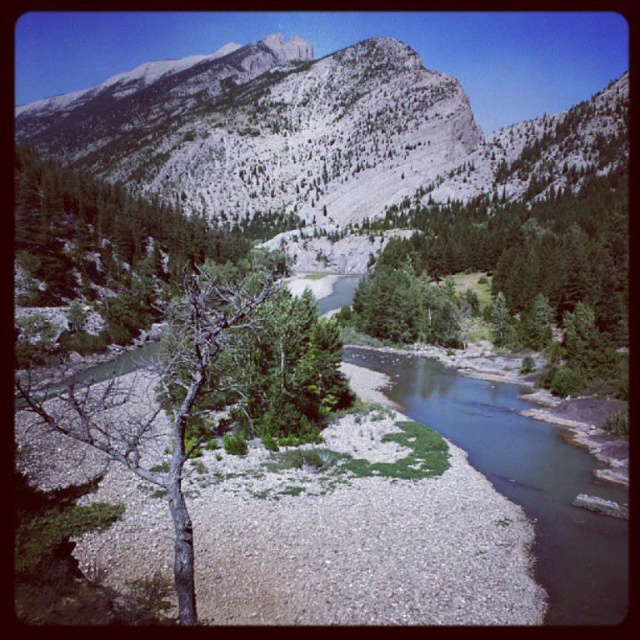
Between gray rocky mountain at upper center and smooth gravel creek at center, which one is positioned lower?

smooth gravel creek at center is below.

Is gray rocky mountain at upper center wider than smooth gravel creek at center?

Yes, gray rocky mountain at upper center is wider than smooth gravel creek at center.

At what (x,y) coordinates should I click in order to perform the action: click on gray rocky mountain at upper center. Please return your answer as a coordinate pair (x, y). Looking at the image, I should click on (298, 132).